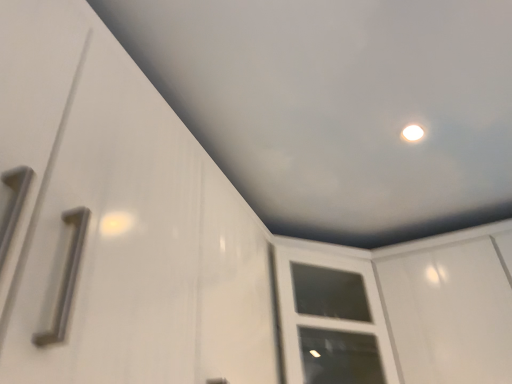
Question: Can you confirm if white glossy cabinet door at center is taller than white glossy screen door at upper right?

Choices:
 (A) yes
 (B) no

Answer: (B)

Question: From a real-world perspective, is white glossy cabinet door at center located higher than white glossy screen door at upper right?

Choices:
 (A) no
 (B) yes

Answer: (B)

Question: Is white glossy cabinet door at center wider than white glossy screen door at upper right?

Choices:
 (A) yes
 (B) no

Answer: (A)

Question: Are white glossy cabinet door at center and white glossy screen door at upper right located far from each other?

Choices:
 (A) no
 (B) yes

Answer: (A)

Question: Is white glossy cabinet door at center closer to camera compared to white glossy screen door at upper right?

Choices:
 (A) yes
 (B) no

Answer: (B)

Question: Is white glossy cabinet door at center looking in the opposite direction of white glossy screen door at upper right?

Choices:
 (A) yes
 (B) no

Answer: (B)

Question: Considering the relative positions of white glossy screen door at upper right and white glossy cabinet door at center in the image provided, is white glossy screen door at upper right to the right of white glossy cabinet door at center from the viewer's perspective?

Choices:
 (A) no
 (B) yes

Answer: (B)

Question: Is white glossy screen door at upper right far from white glossy cabinet door at center?

Choices:
 (A) no
 (B) yes

Answer: (A)

Question: From the image's perspective, does white glossy screen door at upper right appear lower than white glossy cabinet door at center?

Choices:
 (A) yes
 (B) no

Answer: (B)

Question: Can you confirm if white glossy screen door at upper right is taller than white glossy cabinet door at center?

Choices:
 (A) yes
 (B) no

Answer: (A)

Question: Does white glossy screen door at upper right lie in front of white glossy cabinet door at center?

Choices:
 (A) no
 (B) yes

Answer: (B)

Question: Is white glossy screen door at upper right turned away from white glossy cabinet door at center?

Choices:
 (A) yes
 (B) no

Answer: (B)

Question: Considering the positions of point coord(506,284) and point coord(343,279), is point coord(506,284) closer or farther from the camera than point coord(343,279)?

Choices:
 (A) farther
 (B) closer

Answer: (B)